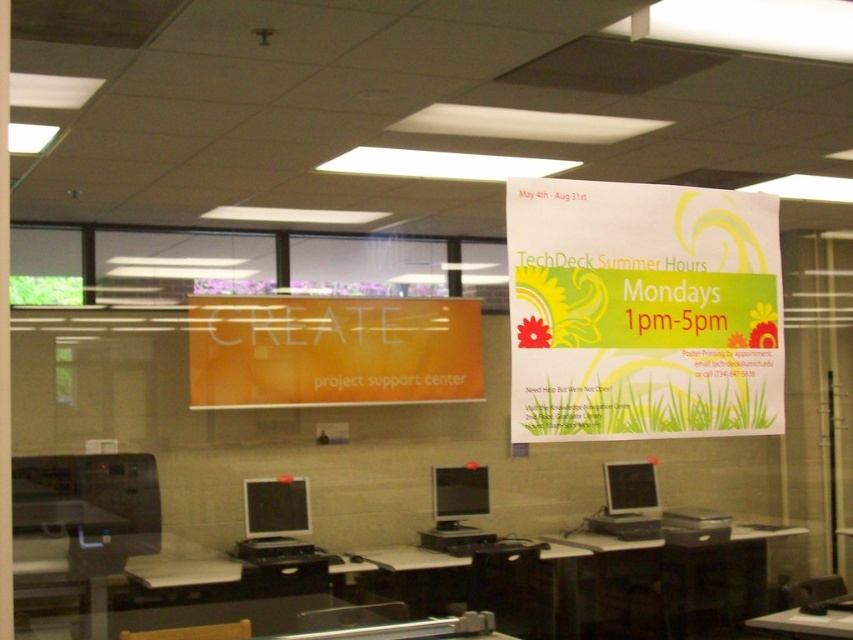
You are standing in the office and see two points marked in the image. The first point is at coordinates point (605, 248) and the second point is at point (799, 609). Which point is closer to you?

Point (605, 248) is in front of point (799, 609), so it is closer to you.

You are standing in the office and want to determine which of the two points, point (270, 372) or point (456, 499), is nearer to you. Based on the scene description, which point is closer?

Point (270, 372) is closer to the camera than point (456, 499), so it is the nearer one.